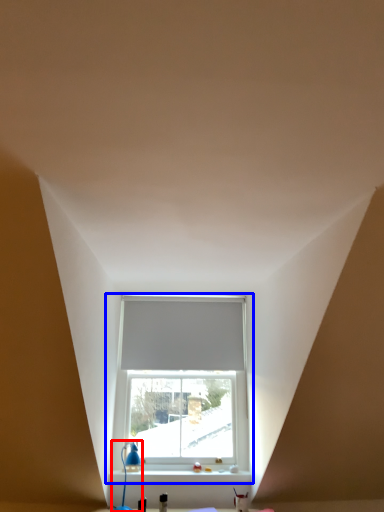
Question: Which of the following is the closest to the observer, table lamp (highlighted by a red box) or window (highlighted by a blue box)?

Choices:
 (A) table lamp
 (B) window

Answer: (A)